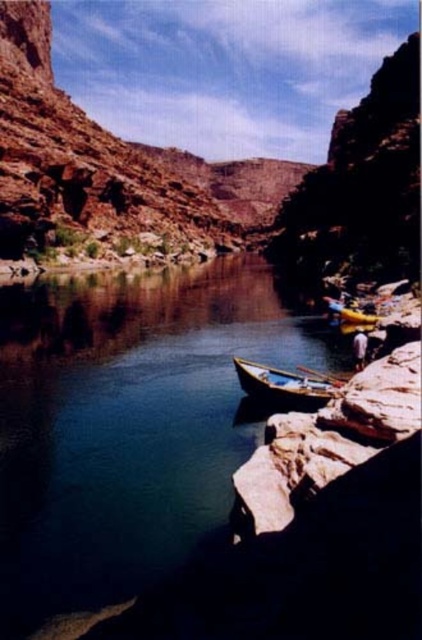
Which of these two, clear blue water at lower left or wooden boat at center, stands shorter?

Standing shorter between the two is wooden boat at center.

Is clear blue water at lower left below wooden boat at center?

Actually, clear blue water at lower left is above wooden boat at center.

Where is `clear blue water at lower left`? The width and height of the screenshot is (422, 640). clear blue water at lower left is located at coordinates (126, 426).

Identify the location of clear blue water at lower left. The height and width of the screenshot is (640, 422). (126, 426).

Locate an element on the screen. The image size is (422, 640). wooden boat at center is located at coordinates (284, 387).

Does wooden boat at center appear on the left side of wooden paddle at lower center?

Indeed, wooden boat at center is positioned on the left side of wooden paddle at lower center.

Does point (272, 369) come closer to viewer compared to point (338, 381)?

That is False.

I want to click on wooden boat at center, so click(284, 387).

Is clear blue water at lower left further to the viewer compared to wooden paddle at lower center?

No, it is not.

Is point (129, 532) farther from camera compared to point (319, 372)?

No, (129, 532) is in front of (319, 372).

Describe the element at coordinates (126, 426) in the screenshot. This screenshot has width=422, height=640. I see `clear blue water at lower left` at that location.

The height and width of the screenshot is (640, 422). I want to click on clear blue water at lower left, so click(x=126, y=426).